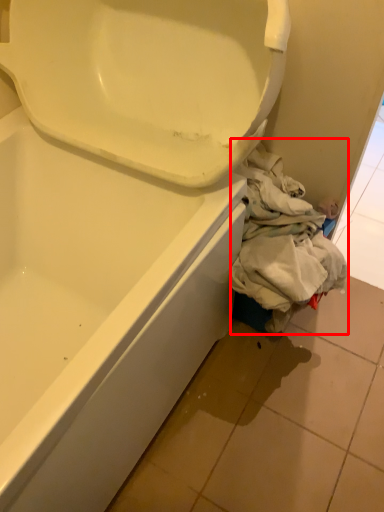
Question: From the image, what is the correct spatial relationship of clothing (annotated by the red box) in relation to tile?

Choices:
 (A) left
 (B) right

Answer: (A)